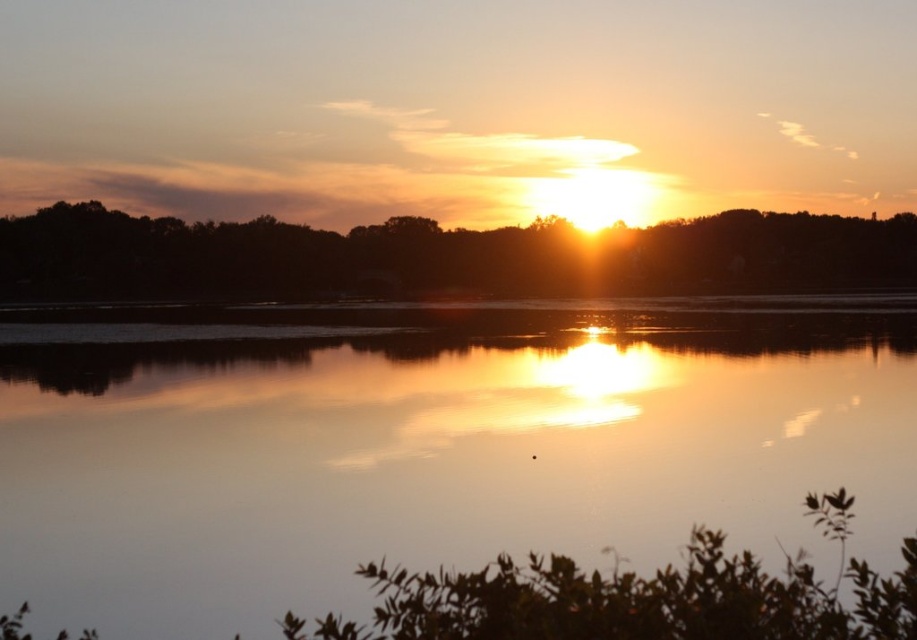
You are an artist trying to paint the sunset scene. You notice the glossy reflective water at center and the silhouette tree at upper center. Which object should you paint first if you want to follow the standard layering technique where objects higher in the image are painted first?

You should paint the silhouette tree at upper center first because it is positioned above the glossy reflective water at center, following the layering technique of painting higher objects first.

You are a photographer aiming to capture the reflection of the sunset in the glossy reflective water at center. Based on its position, where should you focus your camera to ensure the reflection is centered in your shot?

The glossy reflective water at center is located at point (431, 445). To center the reflection, adjust your camera focus to that coordinate.

You are standing at the lakeside and want to take a photo of the sunset. The glossy reflective water at center and the silhouette tree at upper center are both in your view. Which object is positioned closer to you, the photographer?

The glossy reflective water at center is closer to the viewer than the silhouette tree at upper center, so the glossy reflective water at center would be positioned closer to you.